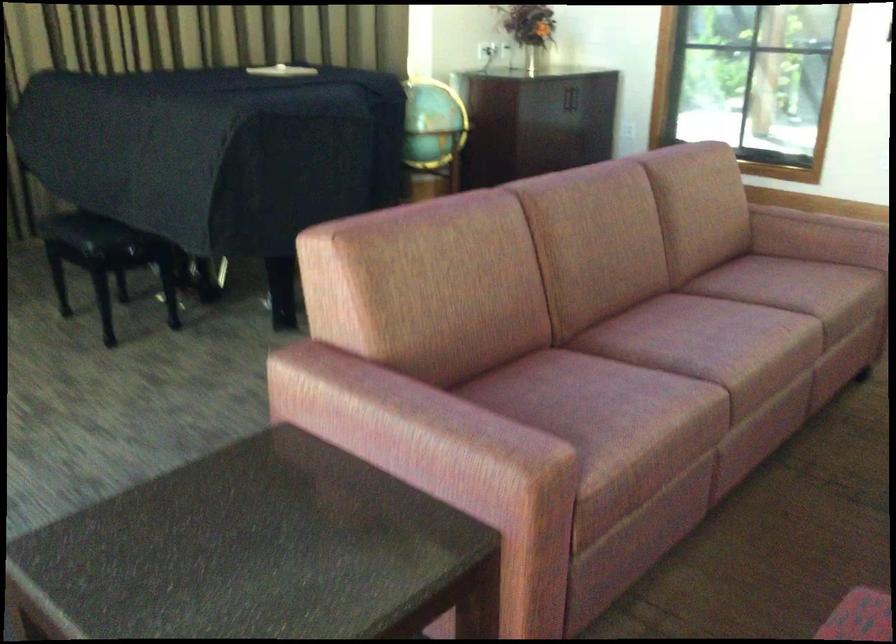
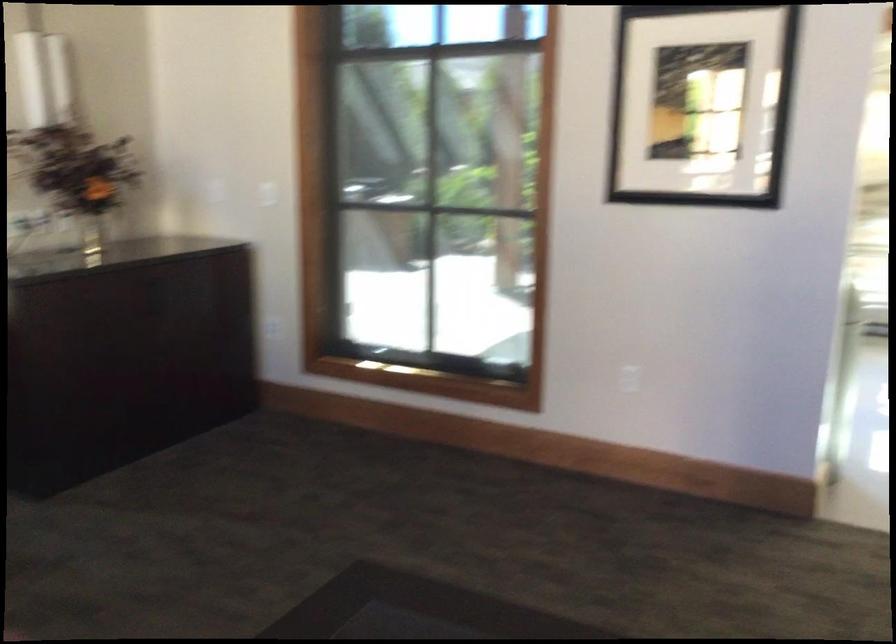
Which direction would the cameraman need to move to produce the second image?

The movement direction of the cameraman is right, forward.